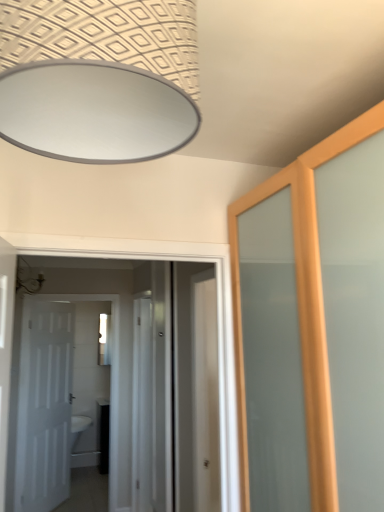
Question: Is clear glass screen door at center positioned with its back to white glossy door at left, the second door when ordered from right to left?

Choices:
 (A) yes
 (B) no

Answer: (B)

Question: Is clear glass screen door at center at the right side of white glossy door at left, the first door viewed from the back?

Choices:
 (A) yes
 (B) no

Answer: (A)

Question: From a real-world perspective, is clear glass screen door at center positioned under white glossy door at left, arranged as the second door when viewed from the front, based on gravity?

Choices:
 (A) yes
 (B) no

Answer: (A)

Question: Considering the relative sizes of clear glass screen door at center and white glossy door at left, the 1th door viewed from the left, in the image provided, is clear glass screen door at center wider than white glossy door at left, the 1th door viewed from the left,?

Choices:
 (A) no
 (B) yes

Answer: (B)

Question: Can you confirm if clear glass screen door at center is positioned to the left of white glossy door at left, the first door viewed from the back?

Choices:
 (A) yes
 (B) no

Answer: (B)

Question: Relative to white glossy door at left, arranged as the second door when viewed from the front, is white glossy door at center, which appears as the first door when viewed from the front, in front or behind?

Choices:
 (A) behind
 (B) front

Answer: (B)

Question: Looking at their shapes, would you say white glossy door at center, the second door viewed from the left, is wider or thinner than white glossy door at left, arranged as the second door when viewed from the front?

Choices:
 (A) wide
 (B) thin

Answer: (A)

Question: From a real-world perspective, is white glossy door at center, acting as the 2th door starting from the back, above or below white glossy door at left, the second door when ordered from right to left?

Choices:
 (A) below
 (B) above

Answer: (B)

Question: Is point [x=99, y=285] closer or farther from the camera than point [x=49, y=401]?

Choices:
 (A) closer
 (B) farther

Answer: (A)

Question: Is clear glass mirror at center situated inside white glossy door at center, the first door viewed from the right, or outside?

Choices:
 (A) inside
 (B) outside

Answer: (B)

Question: Does point (102, 331) appear closer or farther from the camera than point (210, 316)?

Choices:
 (A) closer
 (B) farther

Answer: (B)

Question: Looking at the image, does clear glass mirror at center seem bigger or smaller compared to white glossy door at center, the second door viewed from the left?

Choices:
 (A) big
 (B) small

Answer: (B)

Question: Is clear glass mirror at center wider or thinner than white glossy door at center, acting as the 2th door starting from the back?

Choices:
 (A) wide
 (B) thin

Answer: (B)

Question: Is white glossy door at left, the 1th door viewed from the left, in front of or behind clear glass mirror at center in the image?

Choices:
 (A) behind
 (B) front

Answer: (B)

Question: From a real-world perspective, is white glossy door at left, the second door when ordered from right to left, physically located above or below clear glass mirror at center?

Choices:
 (A) below
 (B) above

Answer: (A)